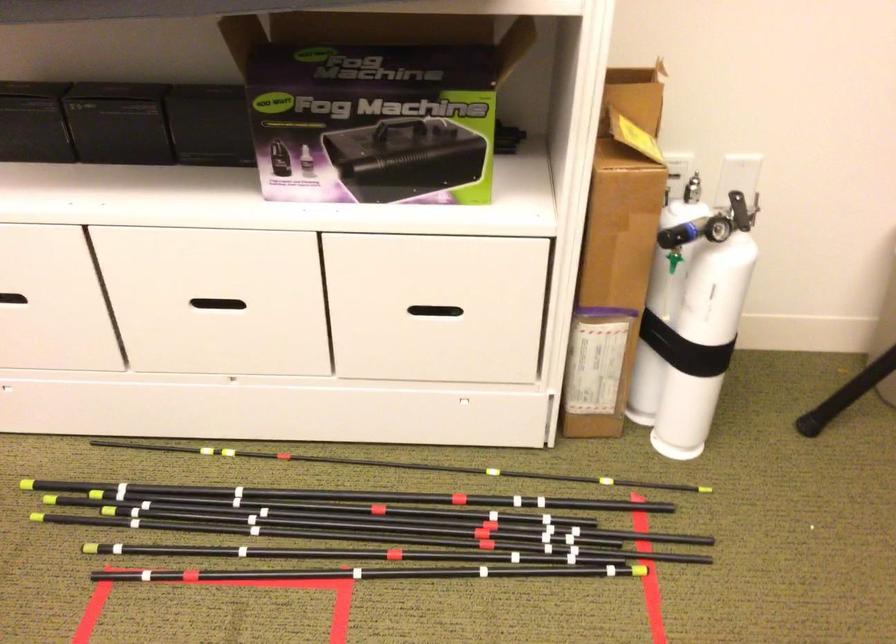
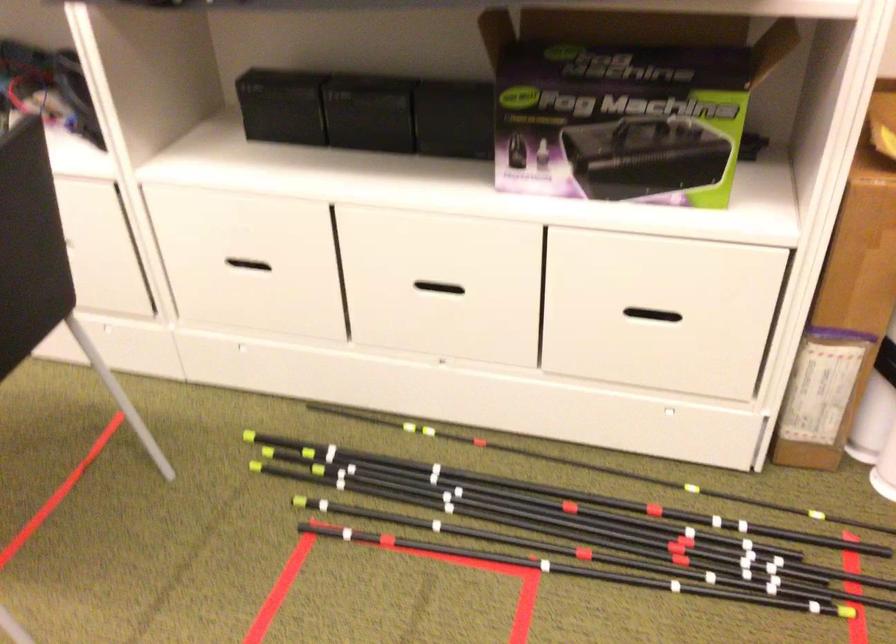
Locate, in the second image, the point that corresponds to (x=106, y=127) in the first image.

(363, 111)